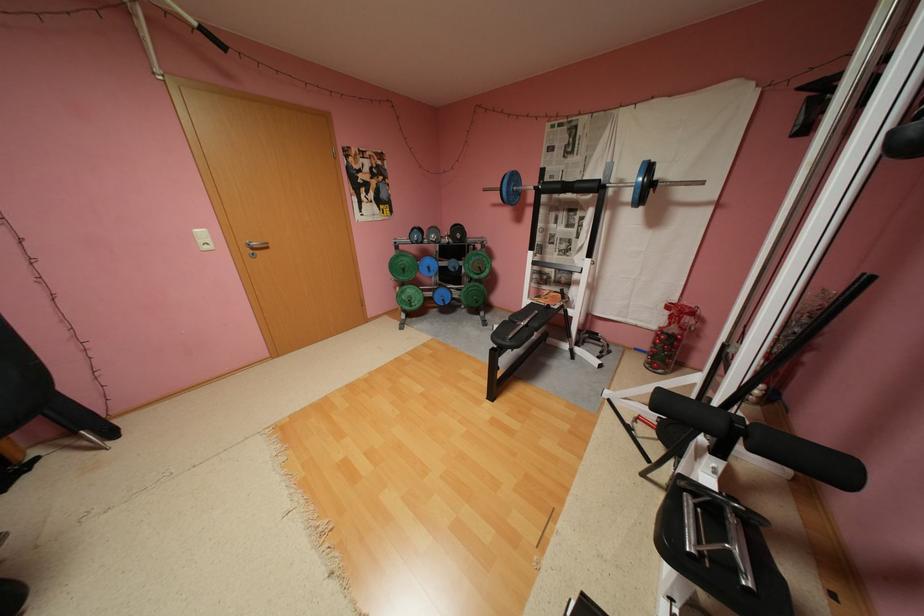
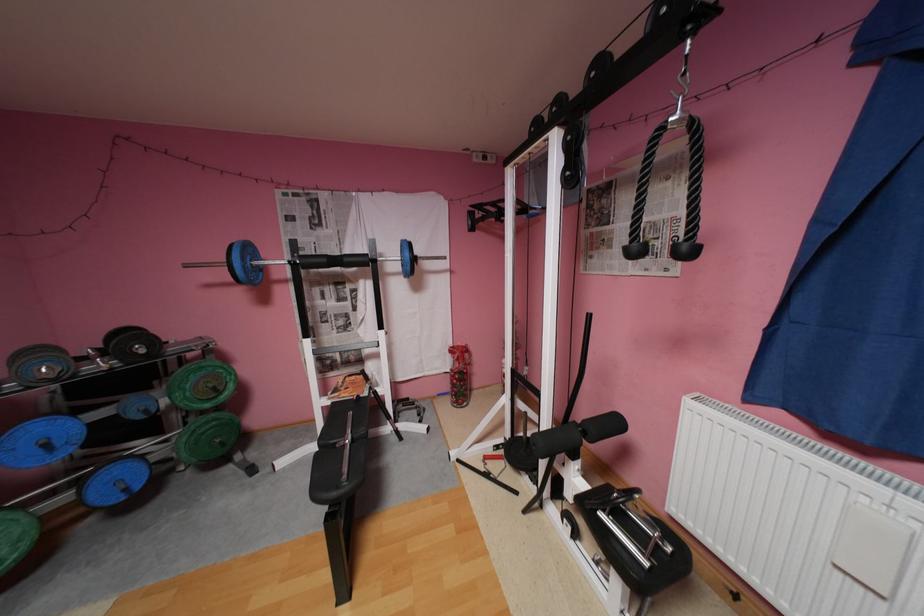
In the second image, find the point that corresponds to point 453,301 in the first image.

(134, 488)